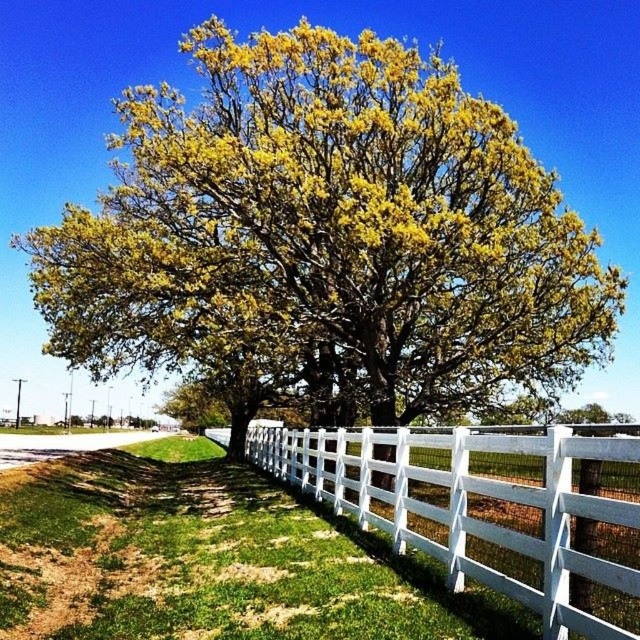
Question: Which of the following is the farthest from the observer?

Choices:
 (A) yellow-green foliage at center
 (B) white wooden fence at lower right

Answer: (A)

Question: Among these points, which one is nearest to the camera?

Choices:
 (A) click(118, 275)
 (B) click(493, 538)

Answer: (B)

Question: Which point is closer to the camera taking this photo?

Choices:
 (A) (305, 173)
 (B) (579, 506)

Answer: (B)

Question: Is yellow-green foliage at center further to the viewer compared to white wooden fence at lower right?

Choices:
 (A) no
 (B) yes

Answer: (B)

Question: Is yellow-green foliage at center to the right of white wooden fence at lower right from the viewer's perspective?

Choices:
 (A) no
 (B) yes

Answer: (A)

Question: Is yellow-green foliage at center further to camera compared to white wooden fence at lower right?

Choices:
 (A) no
 (B) yes

Answer: (B)